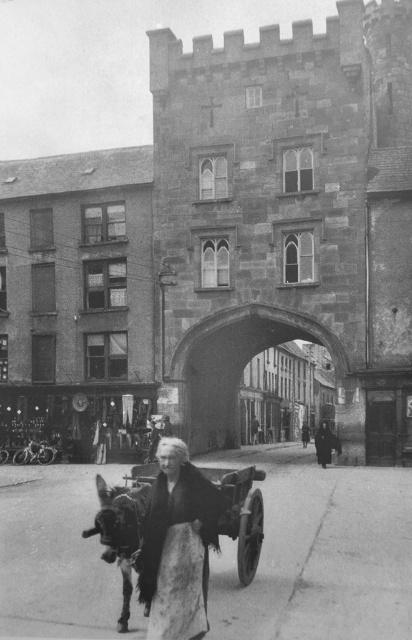
Question: Is the position of dark brown fur coat at center less distant than that of wooden cart at lower center?

Choices:
 (A) yes
 (B) no

Answer: (A)

Question: Can you confirm if dark brown fur coat at center is positioned above wooden cart at lower center?

Choices:
 (A) yes
 (B) no

Answer: (A)

Question: Is dark brown fur coat at center thinner than wooden cart at lower center?

Choices:
 (A) yes
 (B) no

Answer: (A)

Question: Which point appears farthest from the camera in this image?

Choices:
 (A) (201, 496)
 (B) (203, 472)

Answer: (B)